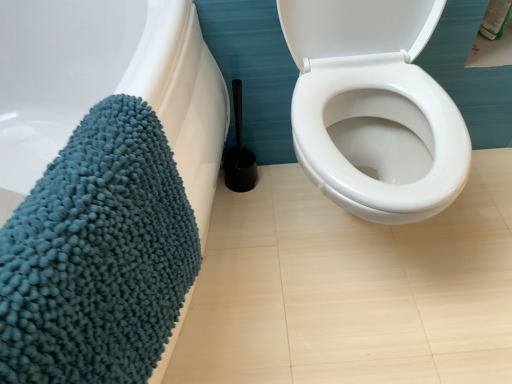
Identify the location of vacant space to the right of black plastic toilet brush at center. The image size is (512, 384). (291, 195).